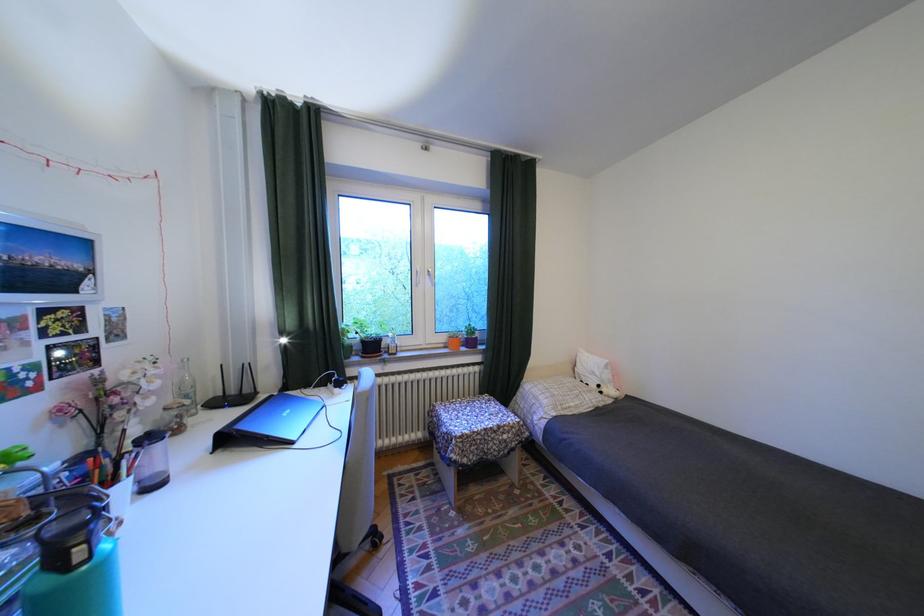
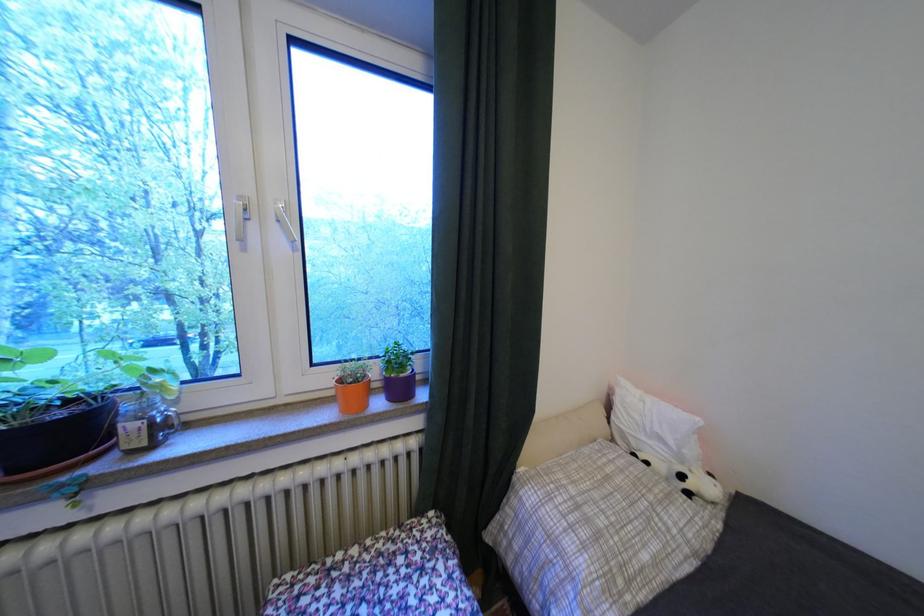
The point at (454, 345) is marked in the first image. Where is the corresponding point in the second image?

(343, 392)